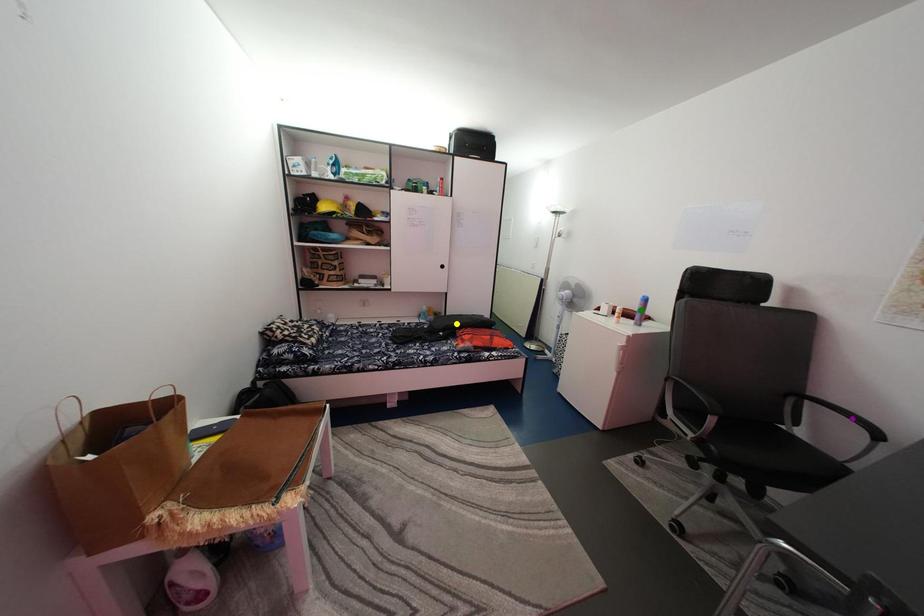
Order these from nearest to farthest:
- yellow point
- green point
- purple point

purple point → green point → yellow point